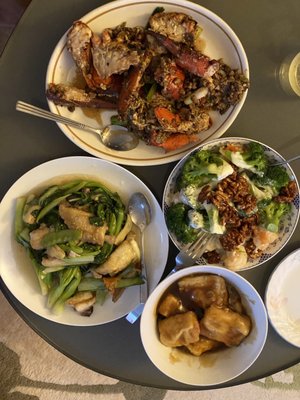
This screenshot has height=400, width=300. Find the location of `grey table`. grey table is located at coordinates (254, 30).